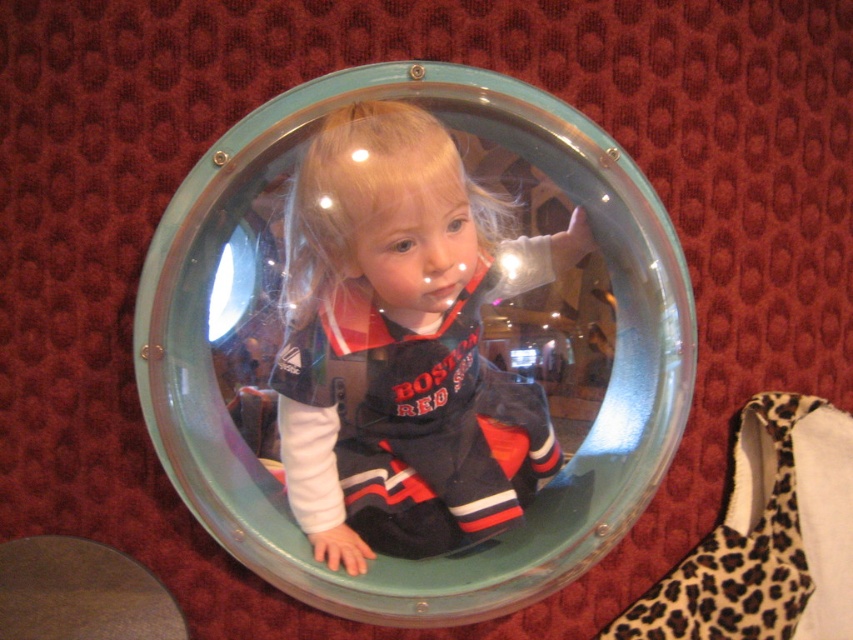
Question: Is transparent plastic dome at center in front of matte black astronaut suit at center?

Choices:
 (A) no
 (B) yes

Answer: (B)

Question: Which object appears closest to the camera in this image?

Choices:
 (A) matte black astronaut suit at center
 (B) transparent plastic dome at center

Answer: (B)

Question: Is transparent plastic dome at center behind matte black astronaut suit at center?

Choices:
 (A) yes
 (B) no

Answer: (B)

Question: Which of the following is the closest to the observer?

Choices:
 (A) matte black astronaut suit at center
 (B) transparent plastic dome at center

Answer: (B)

Question: Which point is closer to the camera taking this photo?

Choices:
 (A) (227, 481)
 (B) (337, 349)

Answer: (B)

Question: Is transparent plastic dome at center bigger than matte black astronaut suit at center?

Choices:
 (A) yes
 (B) no

Answer: (A)